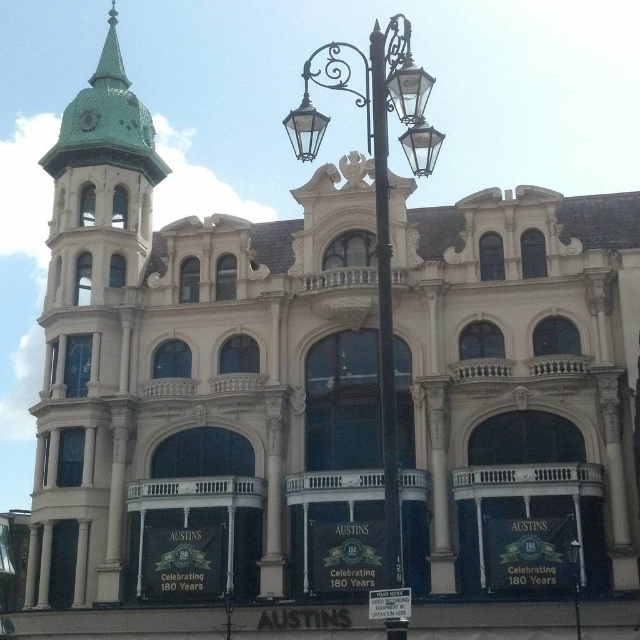
You are standing in front of the grand building and notice a specific point marked at coordinates point (90, 333). What architectural feature does this point correspond to?

The point (90, 333) corresponds to the green painted metal bell tower at left.